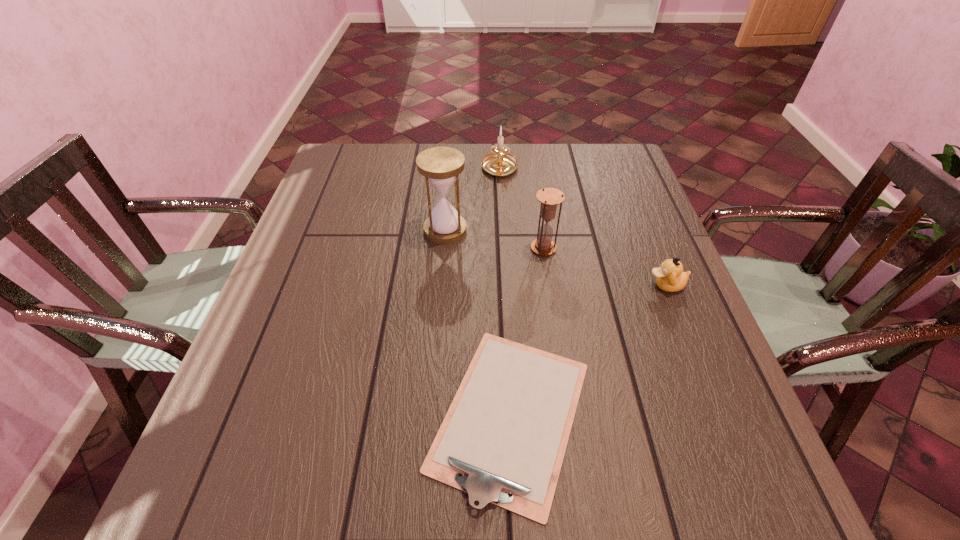
Locate an element on the screen. The height and width of the screenshot is (540, 960). the tallest object is located at coordinates (441, 166).

I want to click on the taller hourglass, so click(441, 166).

This screenshot has width=960, height=540. Identify the location of the fourth shortest object. (549, 197).

The width and height of the screenshot is (960, 540). What are the coordinates of `the shorter hourglass` in the screenshot? It's located at (549, 197).

Image resolution: width=960 pixels, height=540 pixels. I want to click on candle holder, so click(x=499, y=163).

This screenshot has height=540, width=960. I want to click on the farthest object, so click(x=499, y=163).

The width and height of the screenshot is (960, 540). Identify the location of the rightmost object. (670, 277).

This screenshot has height=540, width=960. What are the coordinates of `the second shortest object` in the screenshot? It's located at (670, 277).

This screenshot has width=960, height=540. I want to click on clipboard, so click(x=503, y=439).

Locate an element on the screen. the nearest object is located at coordinates (503, 439).